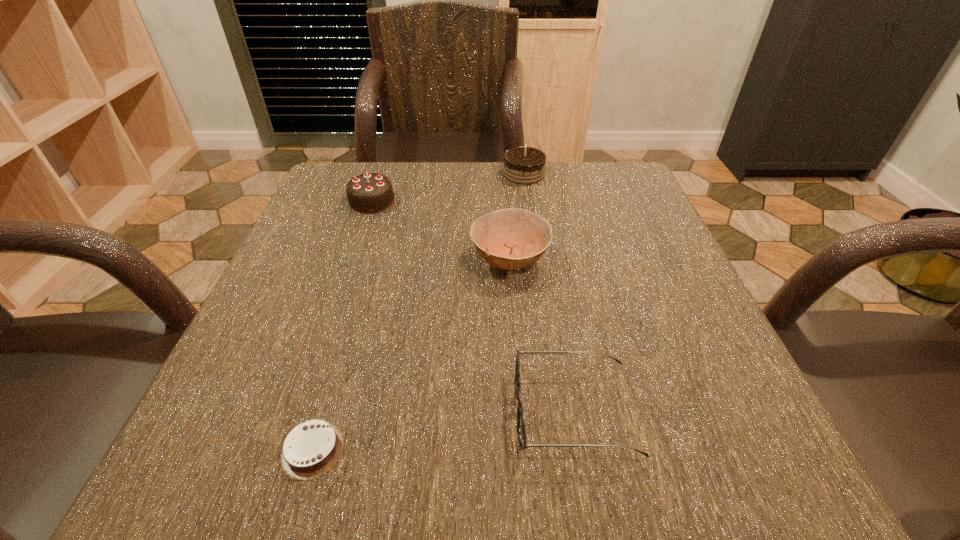
In the image, there is a desktop. Identify the location of vacant space at the left edge. This screenshot has width=960, height=540. (261, 359).

At what (x,y) coordinates should I click in order to perform the action: click on vacant point at the right edge. Please return your answer as a coordinate pair (x, y). This screenshot has width=960, height=540. Looking at the image, I should click on (619, 219).

Identify the location of free region at the far left corner. (391, 171).

You are a GUI agent. You are given a task and a screenshot of the screen. Output one action in this format:
    pyautogui.click(x=<x>, y=<y>)
    Task: Click on the vacant area at the far right corner
    
    Given the screenshot: What is the action you would take?
    pyautogui.click(x=605, y=168)

This screenshot has width=960, height=540. What are the coordinates of `vacant region at the near right corner of the desktop` in the screenshot? It's located at (708, 474).

Locate an element on the screen. The image size is (960, 540). vacant space that is in between the second shortest object and the third nearest object is located at coordinates (541, 336).

What are the coordinates of `free spot between the shortest chocolate cake and the second farthest chocolate cake` in the screenshot? It's located at (342, 325).

Find the location of `empty space that is in between the nearest chocolate cake and the bowl`. empty space that is in between the nearest chocolate cake and the bowl is located at coordinates (411, 354).

You are a GUI agent. You are given a task and a screenshot of the screen. Output one action in this format:
    pyautogui.click(x=<x>, y=<y>)
    Task: Click on the free spot between the second farthest object and the second shortest object
    
    Given the screenshot: What is the action you would take?
    pyautogui.click(x=472, y=307)

Locate an element on the screen. free space between the spectacles and the shortest chocolate cake is located at coordinates (444, 431).